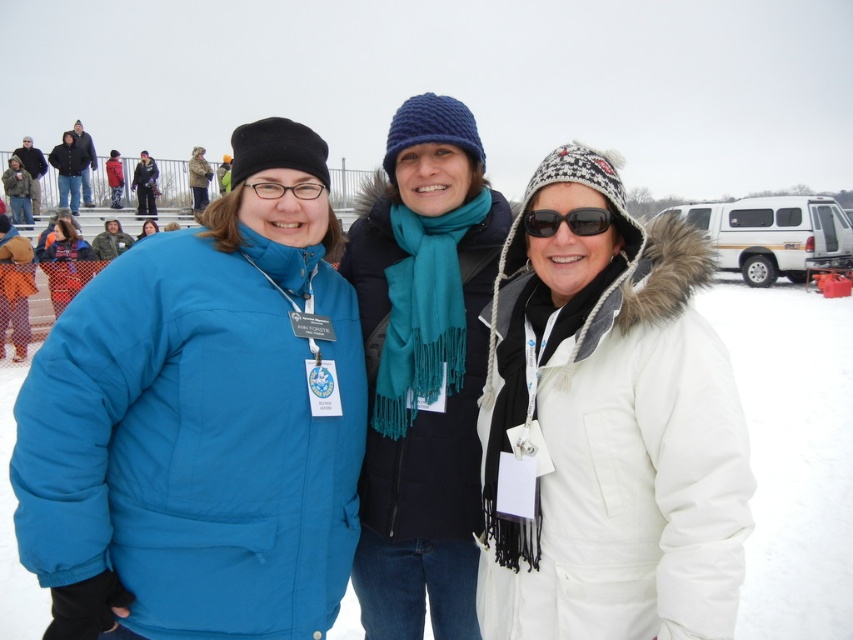
Can you confirm if matte blue puffer jacket at left is wider than black reflective sunglasses at center?

Yes, matte blue puffer jacket at left is wider than black reflective sunglasses at center.

Where is `matte blue puffer jacket at left`? The width and height of the screenshot is (853, 640). matte blue puffer jacket at left is located at coordinates (201, 422).

In order to click on matte blue puffer jacket at left in this screenshot , I will do `click(201, 422)`.

From the picture: Can you confirm if knitted blue hat at center is bigger than matte blue jacket at lower left?

Correct, knitted blue hat at center is larger in size than matte blue jacket at lower left.

Is knitted blue hat at center positioned in front of matte blue jacket at lower left?

Yes, it is.

At what (x,y) coordinates should I click in order to perform the action: click on knitted blue hat at center. Please return your answer as a coordinate pair (x, y). Looking at the image, I should click on (422, 369).

You are a GUI agent. You are given a task and a screenshot of the screen. Output one action in this format:
    pyautogui.click(x=<x>, y=<y>)
    Task: Click on the knitted blue hat at center
    
    Given the screenshot: What is the action you would take?
    pyautogui.click(x=422, y=369)

Is white fur-trimmed coat at center positioned in front of matte black glasses at center?

Yes, white fur-trimmed coat at center is in front of matte black glasses at center.

Measure the distance between white fur-trimmed coat at center and camera.

7.10 feet

Find the location of a particular element. This screenshot has height=640, width=853. white fur-trimmed coat at center is located at coordinates (607, 428).